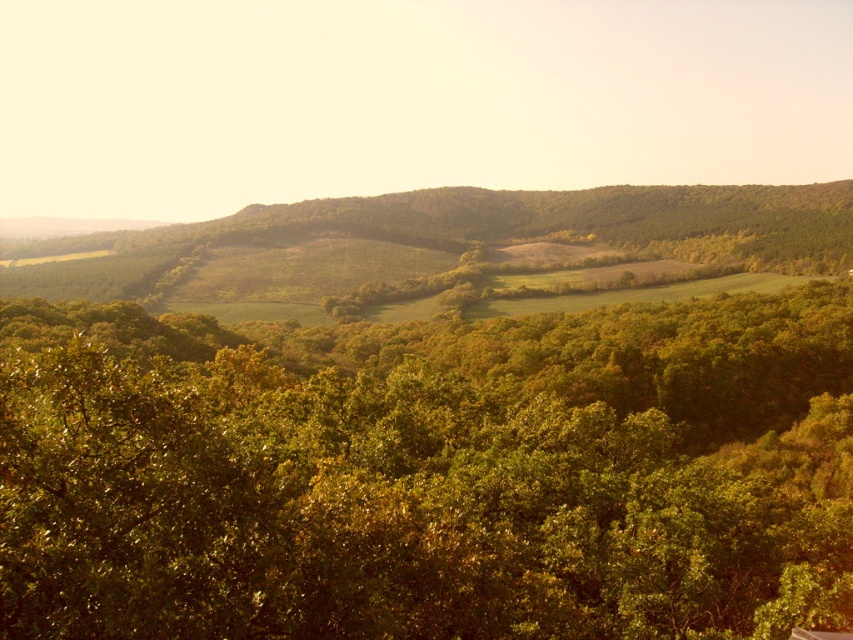
Question: Which of the following is the farthest from the observer?

Choices:
 (A) green leafy trees at center
 (B) green leafy hillside at center

Answer: (B)

Question: Which of the following is the closest to the observer?

Choices:
 (A) green leafy hillside at center
 (B) green leafy trees at center

Answer: (B)

Question: Does green leafy trees at center appear on the right side of green leafy hillside at center?

Choices:
 (A) yes
 (B) no

Answer: (A)

Question: Does green leafy trees at center have a larger size compared to green leafy hillside at center?

Choices:
 (A) yes
 (B) no

Answer: (B)

Question: Can you confirm if green leafy trees at center is positioned to the right of green leafy hillside at center?

Choices:
 (A) no
 (B) yes

Answer: (B)